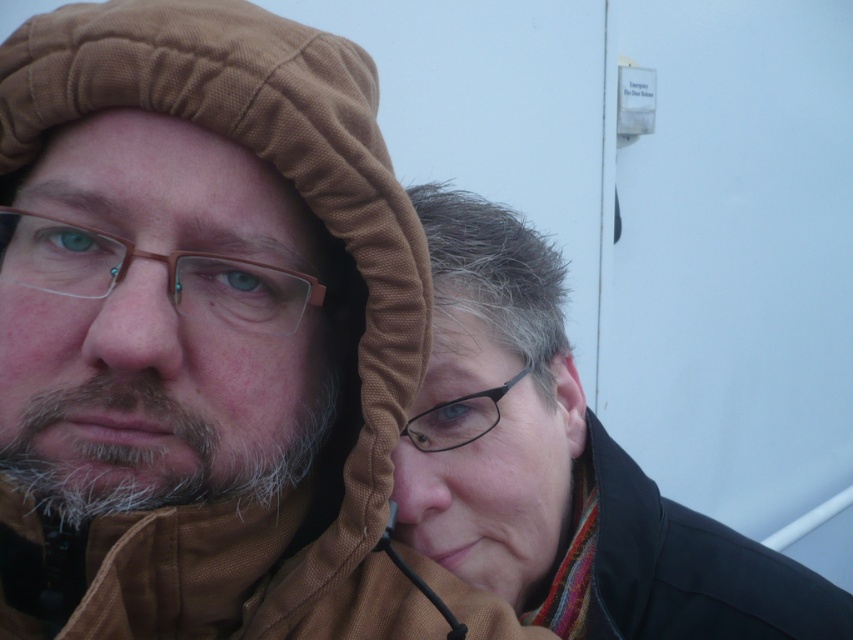
You are standing in a hallway and see the matte black jacket at center and the clear plastic glasses at center. Which object is positioned to the right side?

The matte black jacket at center is to the right of the clear plastic glasses at center.

You are standing in a room with two people. The person in front is wearing a brown hooded jacket and glasses, and the one behind has a colorful scarf. There is a point marked at coordinates (x=505, y=321). If you want to reach that point quickly, which direction should you move in relation to the two people?

The point marked at coordinates (x=505, y=321) is 34.13 inches away from the camera, so you should move towards the direction where the two people are located since the point is closer to the camera than them.

You are standing in a room with two people and a white wall. There is a point at coordinates point (474, 234). Can you determine if this point is closer to you than 1 meter?

The point (474, 234) is 88.60 centimeters away from the viewer, so yes, it is closer than 1 meter since 88.60 cm is less than 100 cm.